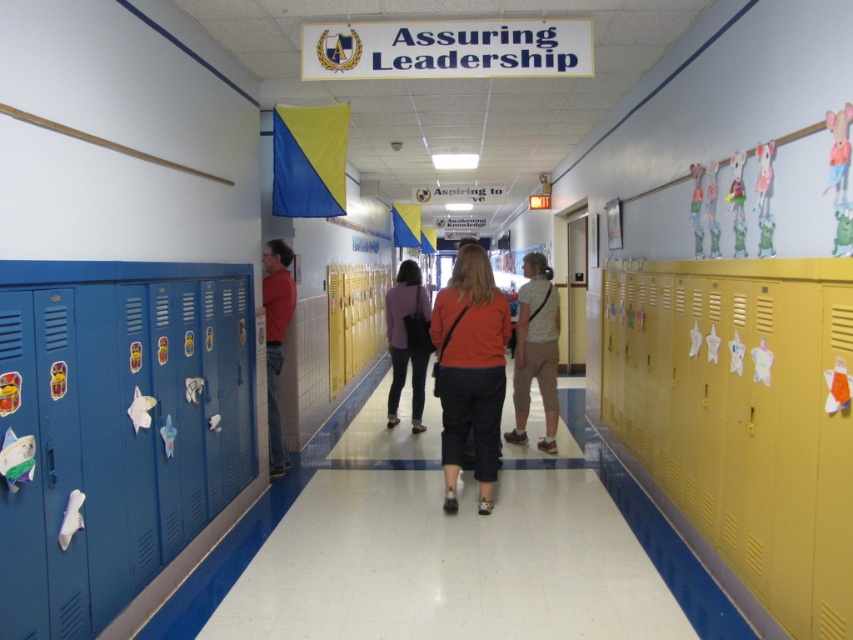
Question: Is orange matte shirt at center thinner than matte purple sweater at center?

Choices:
 (A) no
 (B) yes

Answer: (A)

Question: Which point appears closest to the camera in this image?

Choices:
 (A) (387, 417)
 (B) (274, 403)
 (C) (457, 397)

Answer: (C)

Question: Based on their relative distances, which object is nearer to the matte purple sweater at center?

Choices:
 (A) matte red shirt at left
 (B) orange matte shirt at center
 (C) camouflage-patterned shirt at center

Answer: (C)

Question: Where is matte purple sweater at center located in relation to matte red shirt at left in the image?

Choices:
 (A) right
 (B) left

Answer: (A)

Question: Based on their relative distances, which object is farther from the matte purple sweater at center?

Choices:
 (A) orange matte shirt at center
 (B) matte red shirt at left

Answer: (A)

Question: Can you confirm if camouflage-patterned shirt at center is positioned to the right of matte purple sweater at center?

Choices:
 (A) no
 (B) yes

Answer: (B)